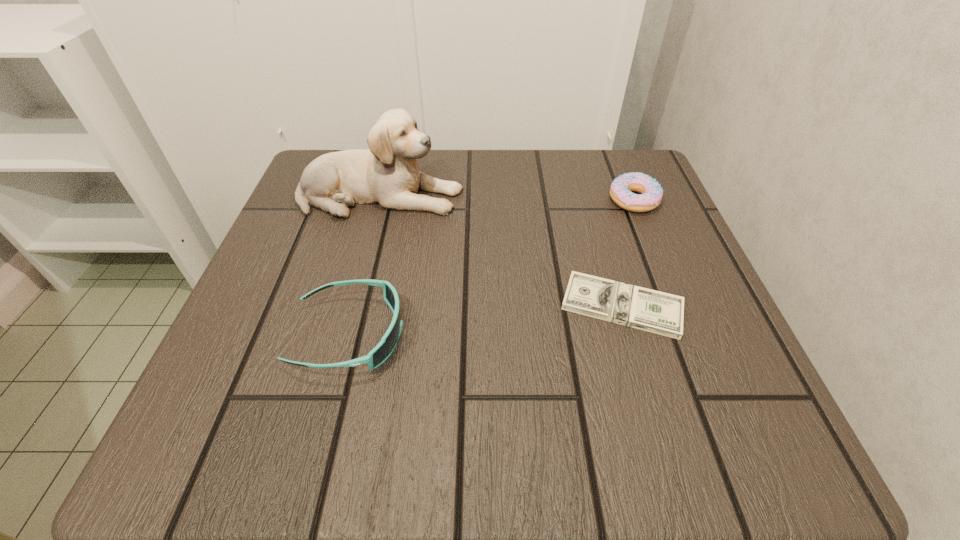
The height and width of the screenshot is (540, 960). What are the coordinates of `vacant space at the near left corner` in the screenshot? It's located at (166, 454).

This screenshot has width=960, height=540. I want to click on free space at the far right corner of the desktop, so click(x=632, y=164).

Image resolution: width=960 pixels, height=540 pixels. Identify the location of vacant space at the near right corner of the desktop. (701, 406).

Image resolution: width=960 pixels, height=540 pixels. What are the coordinates of `free space between the doughnut and the puppy` in the screenshot? It's located at (507, 198).

Locate an element on the screen. The image size is (960, 540). empty space between the shortest object and the puppy is located at coordinates (501, 251).

Where is `vacant area that lies between the puppy and the dollar`? Image resolution: width=960 pixels, height=540 pixels. vacant area that lies between the puppy and the dollar is located at coordinates (501, 251).

Locate an element on the screen. vacant area that lies between the tallest object and the third shortest object is located at coordinates (365, 265).

This screenshot has width=960, height=540. Identify the location of free area in between the second shortest object and the puppy. (507, 198).

I want to click on vacant region between the sunglasses and the dollar, so click(x=486, y=320).

Where is `vacant space that's between the third tallest object and the puppy`? The height and width of the screenshot is (540, 960). vacant space that's between the third tallest object and the puppy is located at coordinates (507, 198).